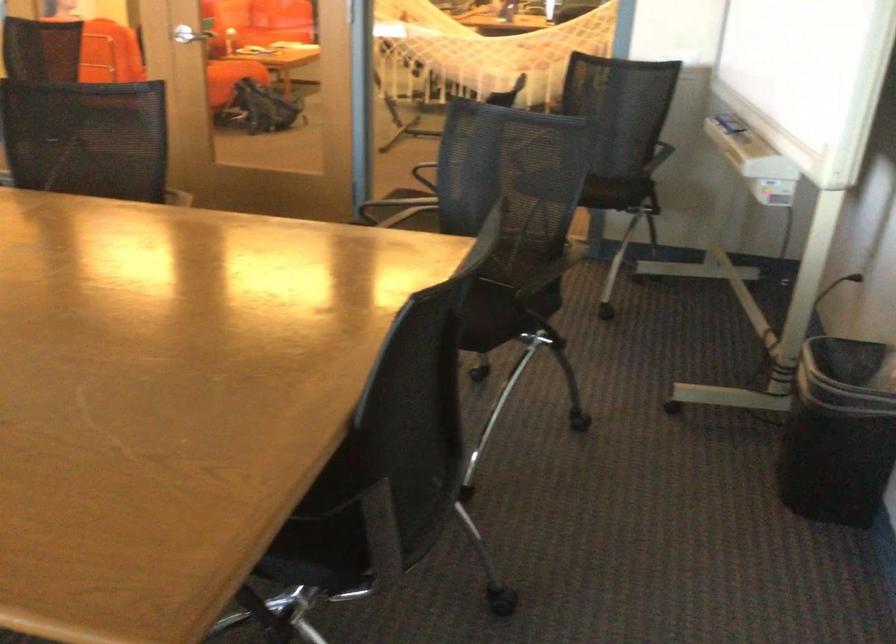
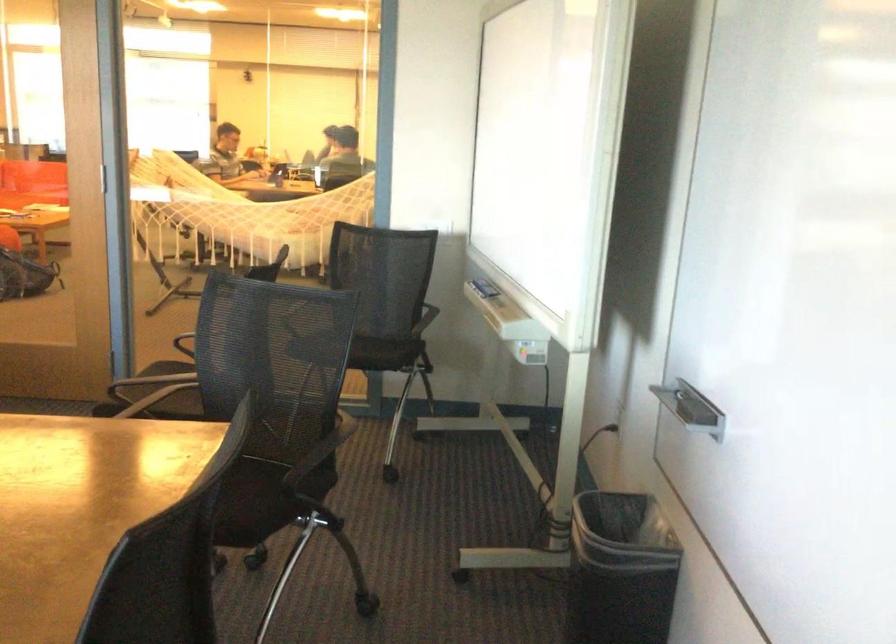
In the second image, find the point that corresponds to pixel 727 122 in the first image.

(484, 288)